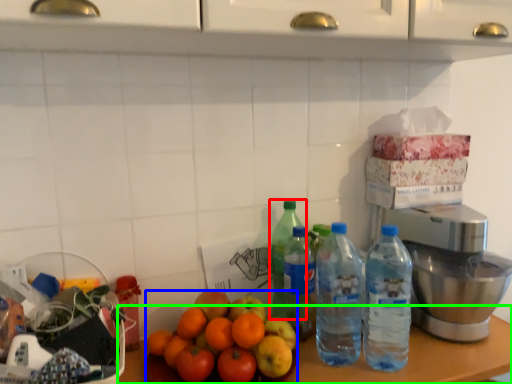
Question: Based on their relative distances, which object is farther from bottle (highlighted by a red box)? Choose from orange (highlighted by a blue box) and table (highlighted by a green box).

Choices:
 (A) orange
 (B) table

Answer: (B)